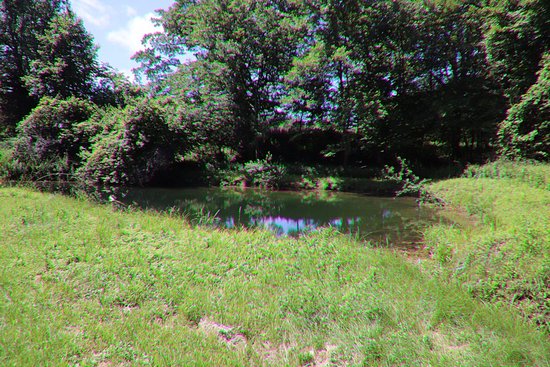
Locate an element on the screen. dark shade is located at coordinates tap(417, 148).